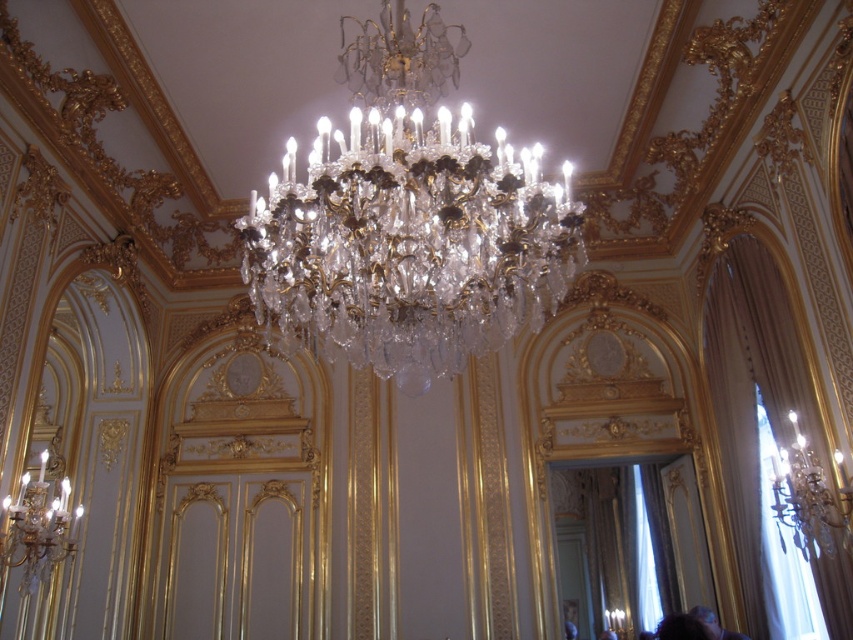
Question: Can you confirm if clear crystal chandelier at upper center is positioned to the left of dark hair at lower right?

Choices:
 (A) no
 (B) yes

Answer: (A)

Question: Is clear crystal chandelier at upper center above dark hair at lower right?

Choices:
 (A) yes
 (B) no

Answer: (A)

Question: Which of the following is the farthest from the observer?

Choices:
 (A) dark hair at lower right
 (B) crystal/golden chandelier at center

Answer: (A)

Question: Which is farther from the crystal/golden chandelier at center?

Choices:
 (A) dark hair at lower right
 (B) smooth skin face at lower right
 (C) clear crystal chandelier at upper center

Answer: (B)

Question: Does crystal/golden chandelier at center come in front of dark hair at lower right?

Choices:
 (A) no
 (B) yes

Answer: (B)

Question: Which object is the farthest from the dark hair at lower right?

Choices:
 (A) smooth skin face at lower right
 (B) clear crystal chandelier at upper center
 (C) crystal/golden chandelier at center

Answer: (C)